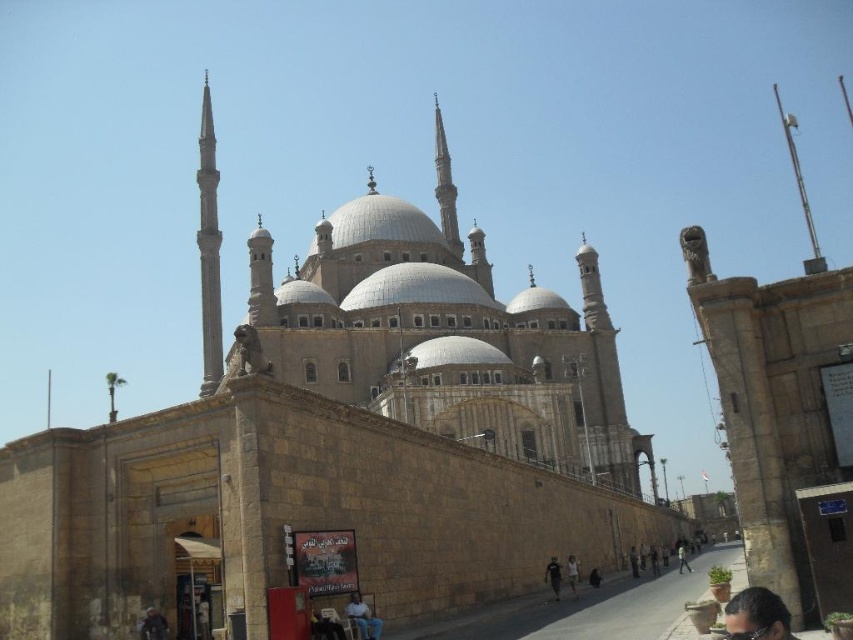
You are standing in front of the grand mosque and notice two items at the base of the structure. The blue jeans at lower center and the dark gray fabric jacket at lower left are both placed near the entrance. If you want to place a rectangular box that is 1 meter wide between them, will there be enough space considering their widths?

The blue jeans at lower center has a larger width than the dark gray fabric jacket at lower left. Since the blue jeans at lower center is wider, the total space between them may be sufficient to accommodate the 1 meter wide box, but it depends on their exact positions and the available space between them. However, the description only provides information about their widths, not the distance between them. Without knowing the distance between the two items, it is impossible to determine if the box will fit.

From the picture: You are a tourist standing at the entrance of the grand mosque and see the blue jeans at lower center. You want to take a photo of the central dome, which is behind the blue jeans. Can you walk straight ahead to get a clear view of the central dome without the blue jeans blocking your view?

The blue jeans at lower center are 53.44 meters away from you. Since the central dome is behind them and there is a significant distance between you and the blue jeans, you can walk straight ahead to get a clear view of the central dome without obstruction.

Consider the image. You are standing in front of the grand mosque and notice a point marked at coordinates point (757, 616). Based on the scene description, can you determine what this point is located on?

The point (757, 616) is located on dark brown hair at lower right.